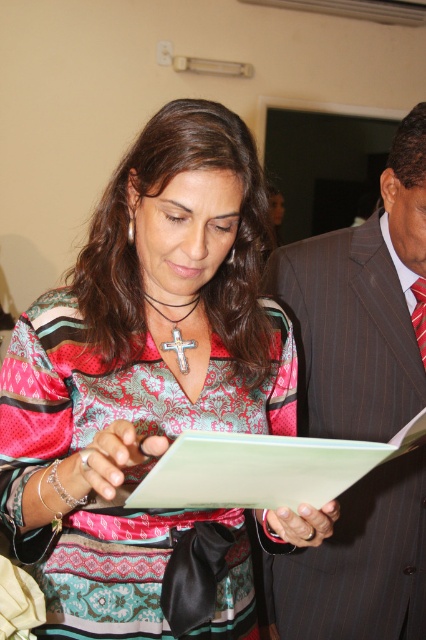
Question: Is striped suit at center wider than multicolored woven tie at right?

Choices:
 (A) yes
 (B) no

Answer: (A)

Question: Which point is closer to the camera?

Choices:
 (A) light green paper at center
 (B) patterned fabric blouse at center
 (C) multicolored woven tie at right

Answer: (A)

Question: Which of the following is the closest to the observer?

Choices:
 (A) striped suit at center
 (B) multicolored woven tie at right
 (C) patterned fabric blouse at center
 (D) light green paper at center

Answer: (D)

Question: Can you confirm if striped suit at center is bigger than light green paper at center?

Choices:
 (A) yes
 (B) no

Answer: (A)

Question: Which point is farther to the camera?

Choices:
 (A) (348, 429)
 (B) (380, 456)

Answer: (A)

Question: Is striped suit at center positioned before light green paper at center?

Choices:
 (A) no
 (B) yes

Answer: (A)